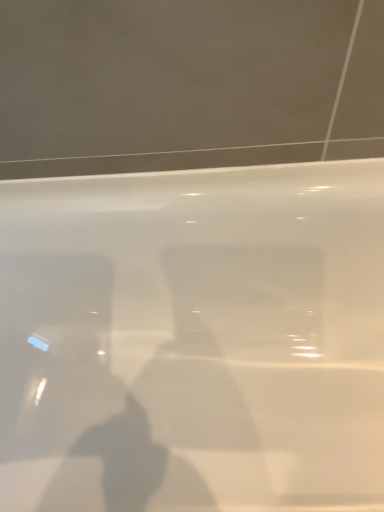
At what (x,y) coordinates should I click in order to perform the action: click on white glossy car at center. Please return your answer as a coordinate pair (x, y). Looking at the image, I should click on (193, 339).

Describe the element at coordinates (193, 339) in the screenshot. The image size is (384, 512). I see `white glossy car at center` at that location.

I want to click on white glossy car at center, so click(193, 339).